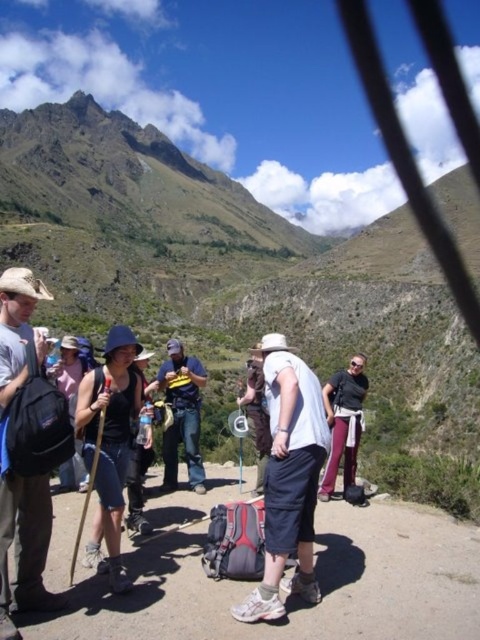
Question: Estimate the real-world distances between objects in this image. Which object is closer to the white cotton shirt at center?

Choices:
 (A) matte black backpack at center
 (B) denim jeans at center
 (C) matte black backpack at left
 (D) matte black shirt at center

Answer: (D)

Question: In this image, where is matte black backpack at center located relative to matte black shirt at center?

Choices:
 (A) right
 (B) left

Answer: (B)

Question: Based on their relative distances, which object is nearer to the matte black shirt at center?

Choices:
 (A) matte black backpack at center
 (B) denim jeans at center
 (C) dirt path at center

Answer: (C)

Question: Estimate the real-world distances between objects in this image. Which object is closer to the white cotton shirt at center?

Choices:
 (A) matte black backpack at center
 (B) dirt path at center

Answer: (B)

Question: Does white cotton shirt at center have a greater width compared to matte black shirt at center?

Choices:
 (A) no
 (B) yes

Answer: (A)

Question: Is white cotton shirt at center bigger than denim jeans at center?

Choices:
 (A) no
 (B) yes

Answer: (B)